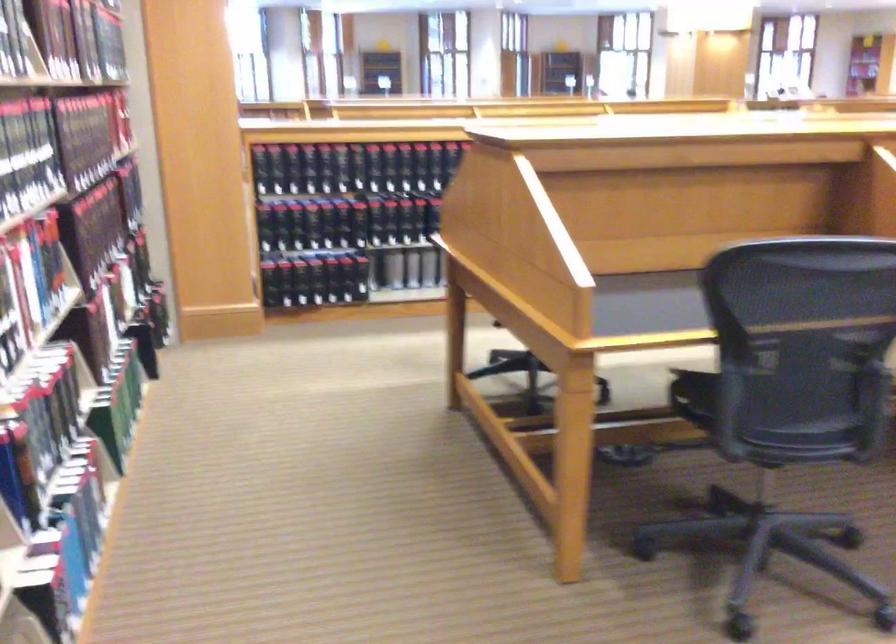
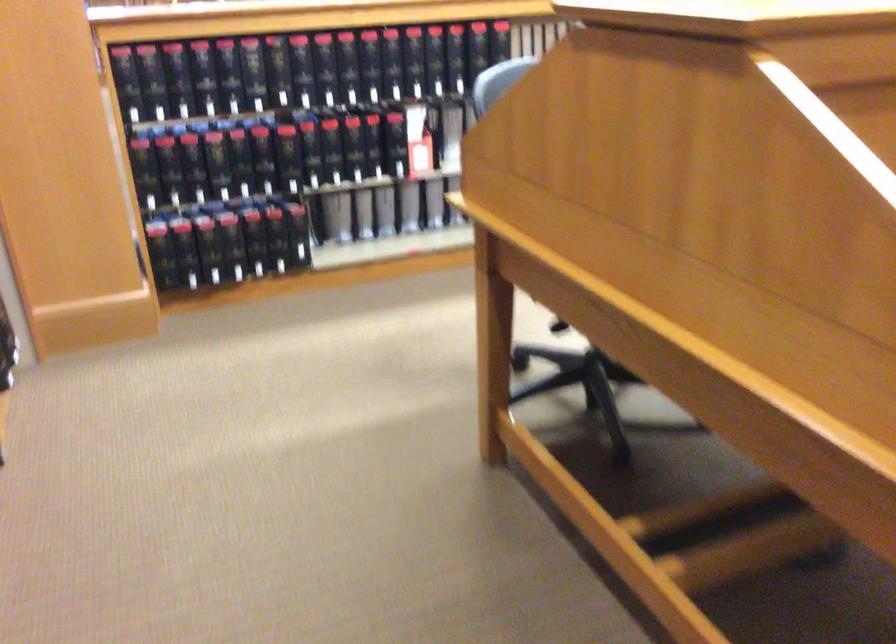
Locate, in the second image, the point that corresponds to (364,158) in the first image.

(291, 71)